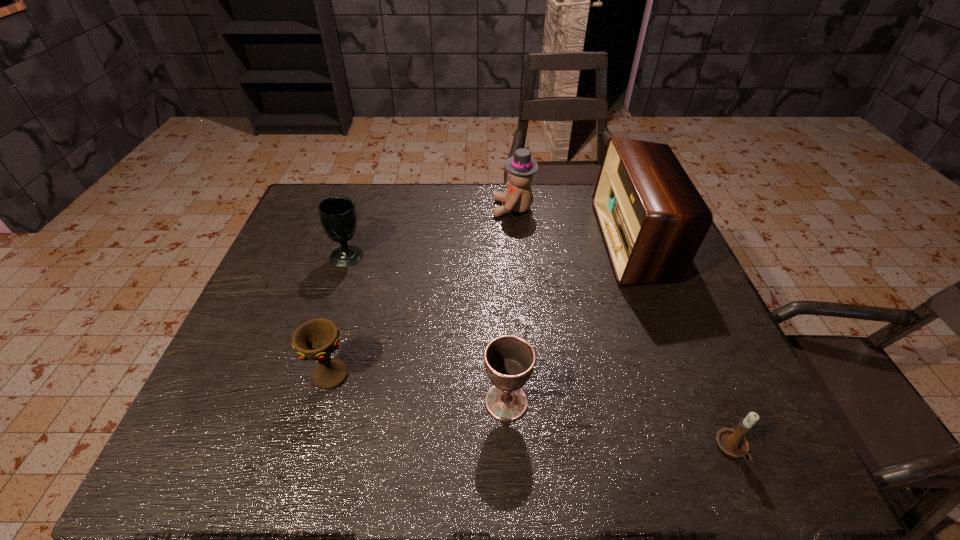
Locate an element on the screen. the tallest object is located at coordinates (653, 220).

Identify the location of rag_doll. (520, 168).

The image size is (960, 540). I want to click on the farthest chalice, so click(x=338, y=216).

Image resolution: width=960 pixels, height=540 pixels. Find the location of `the rightmost chalice`. the rightmost chalice is located at coordinates (509, 360).

Locate an element on the screen. This screenshot has width=960, height=540. the shortest object is located at coordinates (732, 442).

The width and height of the screenshot is (960, 540). Identify the location of the nearest object. (732, 442).

You are a GUI agent. You are given a task and a screenshot of the screen. Output one action in this format:
    pyautogui.click(x=<x>, y=<y>)
    Task: Click on the vacant space located on the front-facing side of the radio receiver
    
    Given the screenshot: What is the action you would take?
    pyautogui.click(x=556, y=241)

Find the location of `vacant area situated 0.080m on the front-facing side of the radio receiver`. vacant area situated 0.080m on the front-facing side of the radio receiver is located at coordinates (576, 241).

This screenshot has width=960, height=540. I want to click on vacant space located on the front-facing side of the radio receiver, so click(x=478, y=241).

Where is `free space located on the front-facing side of the rag_doll`? The image size is (960, 540). free space located on the front-facing side of the rag_doll is located at coordinates (437, 208).